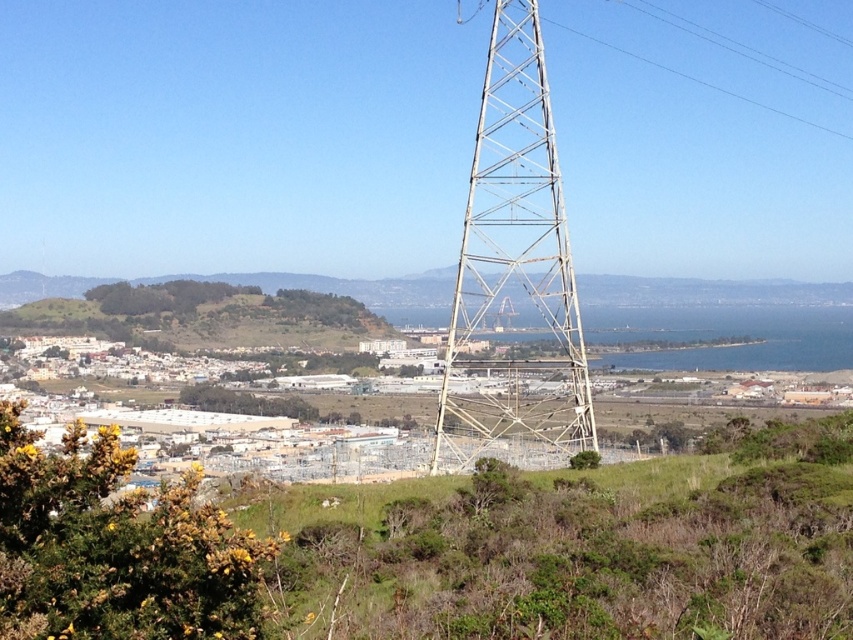
You are standing at the point indicated by point (514, 273) in the image. Looking around, you see a metallic structure at center. Based on the scene description, what is the closest object to you?

The closest object to you is the metallic structure at center, as you are positioned at point (514, 273) which indicates the metallic structure at center.

You are a drone operator planning to fly a drone from the metallic structure at center to the green grassy hillside at center. Considering their sizes, which object will require more careful navigation due to its size?

The metallic structure at center is larger than the green grassy hillside at center, so navigating around the metallic structure at center requires more careful attention due to its bigger size.